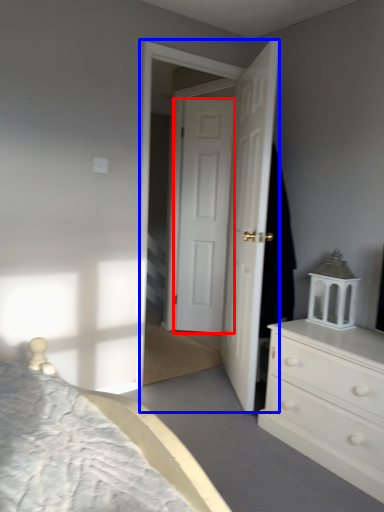
Question: Which object appears farthest to the camera in this image, door (highlighted by a red box) or screen door (highlighted by a blue box)?

Choices:
 (A) door
 (B) screen door

Answer: (A)